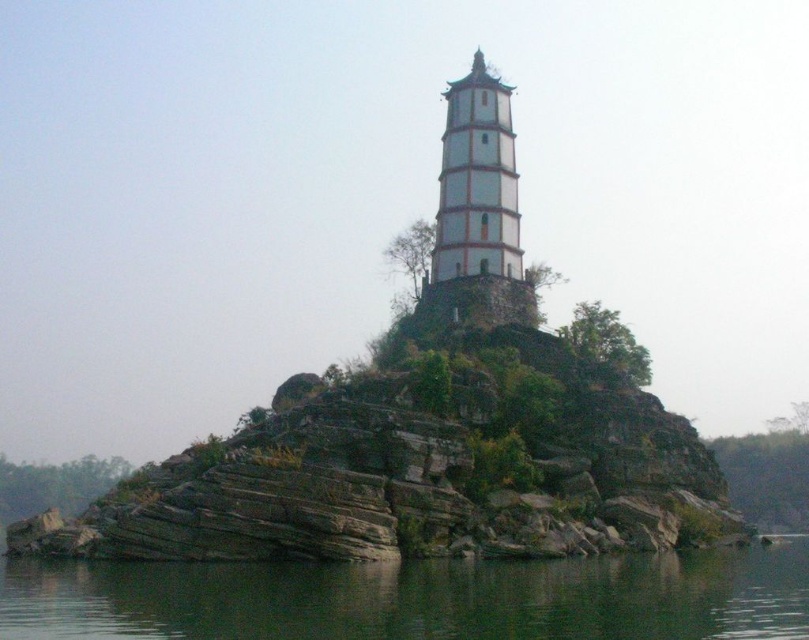
Question: Is greenish water at lower center behind white stone tower at center?

Choices:
 (A) yes
 (B) no

Answer: (B)

Question: Can you confirm if greenish water at lower center is positioned to the left of white stone tower at center?

Choices:
 (A) yes
 (B) no

Answer: (A)

Question: Which of the following is the closest to the observer?

Choices:
 (A) (485, 216)
 (B) (791, 545)

Answer: (A)

Question: Which object appears closest to the camera in this image?

Choices:
 (A) greenish water at lower center
 (B) white stone tower at center

Answer: (A)

Question: Is greenish water at lower center to the right of white stone tower at center from the viewer's perspective?

Choices:
 (A) no
 (B) yes

Answer: (A)